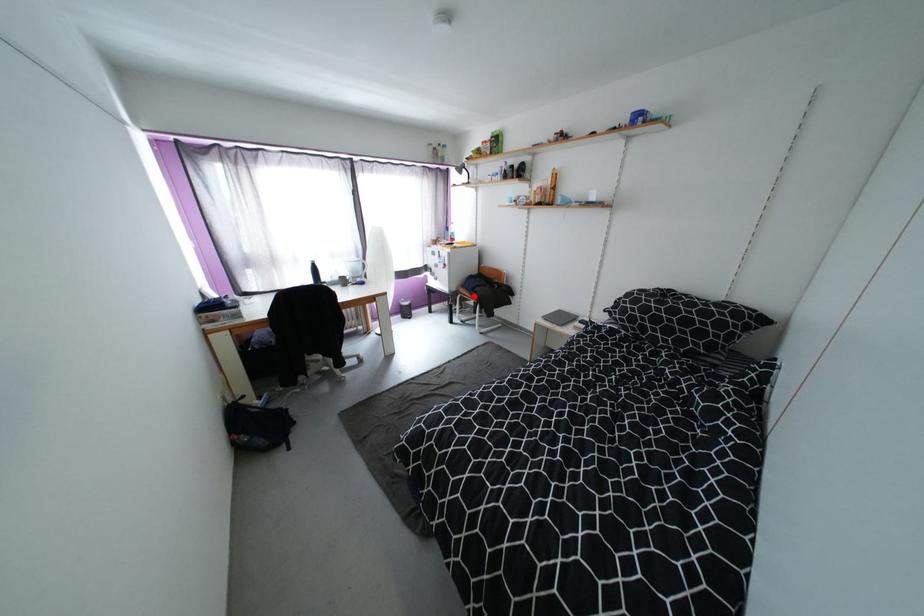
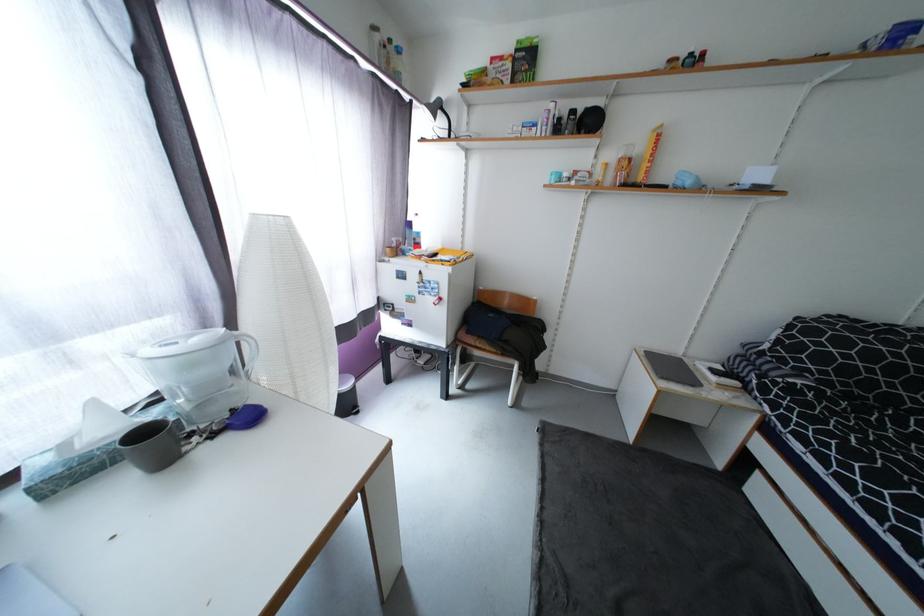
In the second image, find the point that corresponds to the highlighted location in the first image.

(493, 349)